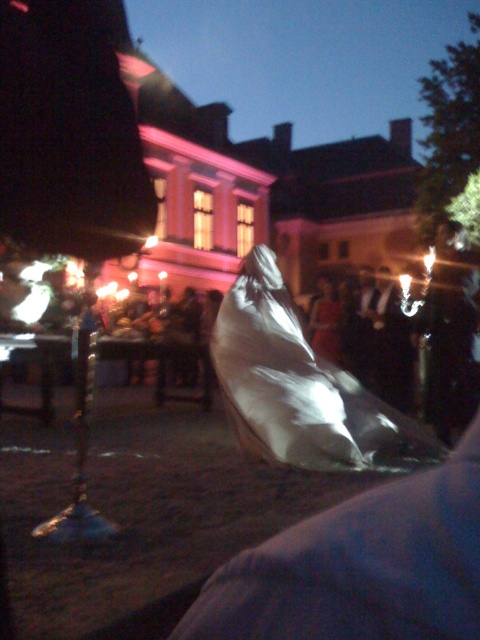
Is shiny metallic foil at center to the right of silky white fabric at center from the viewer's perspective?

No, shiny metallic foil at center is not to the right of silky white fabric at center.

Can you confirm if shiny metallic foil at center is taller than silky white fabric at center?

In fact, shiny metallic foil at center may be shorter than silky white fabric at center.

Locate an element on the screen. The height and width of the screenshot is (640, 480). shiny metallic foil at center is located at coordinates (300, 387).

Identify the location of shiny metallic foil at center. (300, 387).